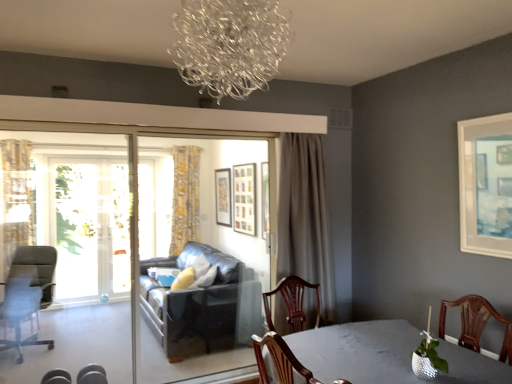
The height and width of the screenshot is (384, 512). Find the location of `free point below matte black office chair at left, the 1th chair from the left (from a real-world perspective)`. free point below matte black office chair at left, the 1th chair from the left (from a real-world perspective) is located at coordinates (31, 345).